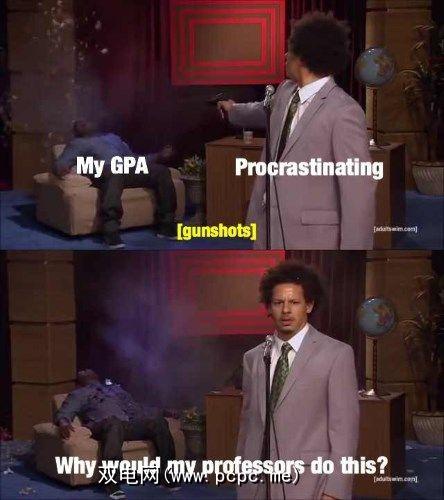
Where is `globe`? Image resolution: width=444 pixels, height=500 pixels. globe is located at coordinates (368, 313), (381, 64).